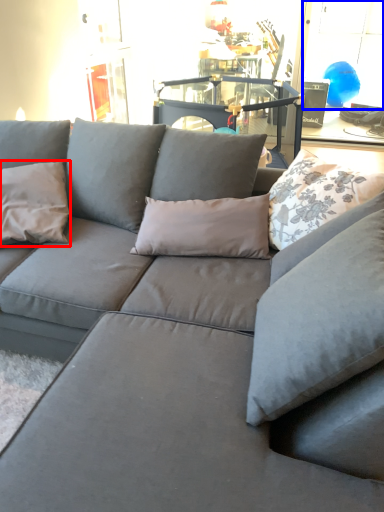
Question: Which of the following is the farthest to the observer, pillow (highlighted by a red box) or window (highlighted by a blue box)?

Choices:
 (A) pillow
 (B) window

Answer: (B)